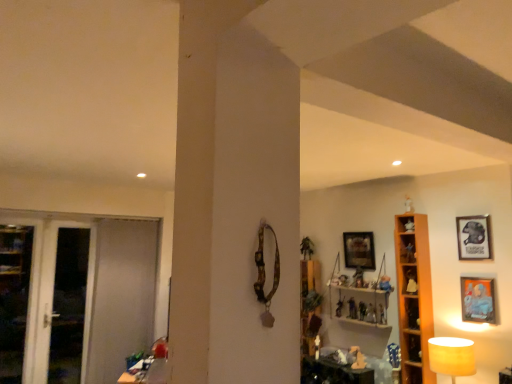
Question: Is white glossy screen door at left, the second screen door in the right-to-left sequence, wider or thinner than matte plastic toy at center, positioned as the 5th toy in left-to-right order?

Choices:
 (A) wide
 (B) thin

Answer: (A)

Question: Is white glossy screen door at left, the second screen door in the right-to-left sequence, spatially inside matte plastic toy at center, which ranks as the 2th toy in right-to-left order, or outside of it?

Choices:
 (A) inside
 (B) outside

Answer: (B)

Question: Which object is the farthest from the matte wooden picture frame at right, the third picture frame in the back-to-front sequence?

Choices:
 (A) wooden table at lower left
 (B) wooden cabinet at right, which ranks as the second cabinet in back-to-front order
 (C) wooden picture frame at upper center, which appears as the third picture frame when viewed from the right
 (D) translucent plastic figurine at center-right, placed as the third toy when sorted from front to back
 (E) wooden cabinet at left, which appears as the second cabinet when viewed from the right

Answer: (E)

Question: Estimate the real-world distances between objects in this image. Which object is closer to the matte wooden picture frame at right, the third picture frame in the back-to-front sequence?

Choices:
 (A) wooden picture frame at upper center, which appears as the 1th picture frame when viewed from the back
 (B) matte plastic toy at center, which is the 3th toy in bottom-to-top order
 (C) matte yellow lampshade at lower right
 (D) wooden figurine at center, the 1th toy positioned from the left
 (E) wooden cabinet at left, which is counted as the 1th cabinet, starting from the bottom

Answer: (C)